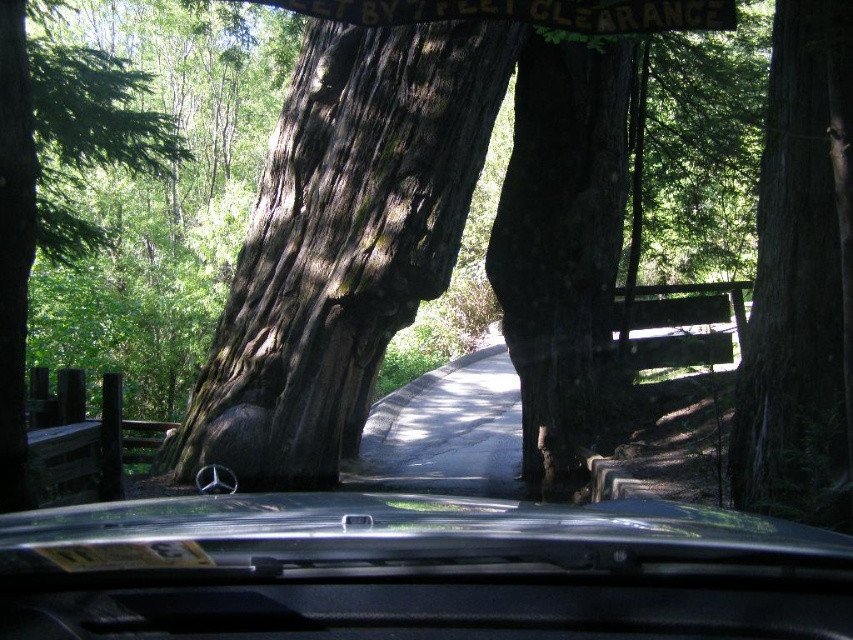
Does dark brown textured bark at center come in front of green rough bark tree at center?

No, dark brown textured bark at center is further to the viewer.

From the picture: Who is lower down, dark brown textured bark at center or green rough bark tree at center?

dark brown textured bark at center is below.

Which is behind, point (288, 307) or point (42, 54)?

The point (42, 54) is behind.

The image size is (853, 640). Find the location of `dark brown textured bark at center`. dark brown textured bark at center is located at coordinates (341, 243).

Does black metallic car at center have a lesser width compared to green rough bark tree at center?

Indeed, black metallic car at center has a lesser width compared to green rough bark tree at center.

Which of these two, black metallic car at center or green rough bark tree at center, stands taller?

With more height is green rough bark tree at center.

Is point (85, 522) farther from viewer compared to point (99, 108)?

No, it is not.

Locate an element on the screen. The height and width of the screenshot is (640, 853). black metallic car at center is located at coordinates tap(416, 570).

Between smooth brown bark at right and green rough bark tree at center, which one appears on the right side from the viewer's perspective?

From the viewer's perspective, smooth brown bark at right appears more on the right side.

Is point (831, 512) behind point (19, 262)?

No, it is in front of (19, 262).

Find the location of a particular element. Image resolution: width=853 pixels, height=640 pixels. smooth brown bark at right is located at coordinates (801, 280).